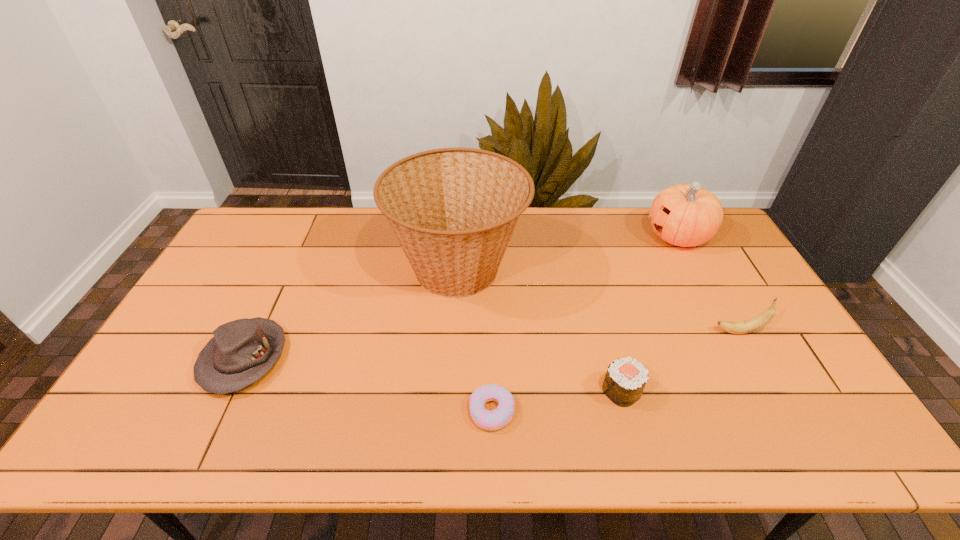
The height and width of the screenshot is (540, 960). Find the location of `free space located 0.220m at the start of the peel on the third tallest object`. free space located 0.220m at the start of the peel on the third tallest object is located at coordinates (636, 332).

I want to click on free space located 0.160m at the start of the peel on the third tallest object, so click(658, 332).

Image resolution: width=960 pixels, height=540 pixels. Find the location of `free location located at the start of the peel on the third tallest object`. free location located at the start of the peel on the third tallest object is located at coordinates (689, 332).

Find the location of a particular element. This screenshot has height=540, width=960. vacant space located on the decorative side of the leftmost object is located at coordinates [x=204, y=442].

Image resolution: width=960 pixels, height=540 pixels. Identify the location of free space located on the left of the sushi. (551, 391).

Where is `vacant space situated 0.160m on the back of the doughnut`? The image size is (960, 540). vacant space situated 0.160m on the back of the doughnut is located at coordinates (491, 341).

The width and height of the screenshot is (960, 540). I want to click on basket that is at the far edge, so click(x=453, y=211).

Find the location of `pumpkin at the far edge`. pumpkin at the far edge is located at coordinates (684, 215).

Identify the location of object situated at the near edge. (492, 420).

The image size is (960, 540). I want to click on object located in the left edge section of the desktop, so click(242, 351).